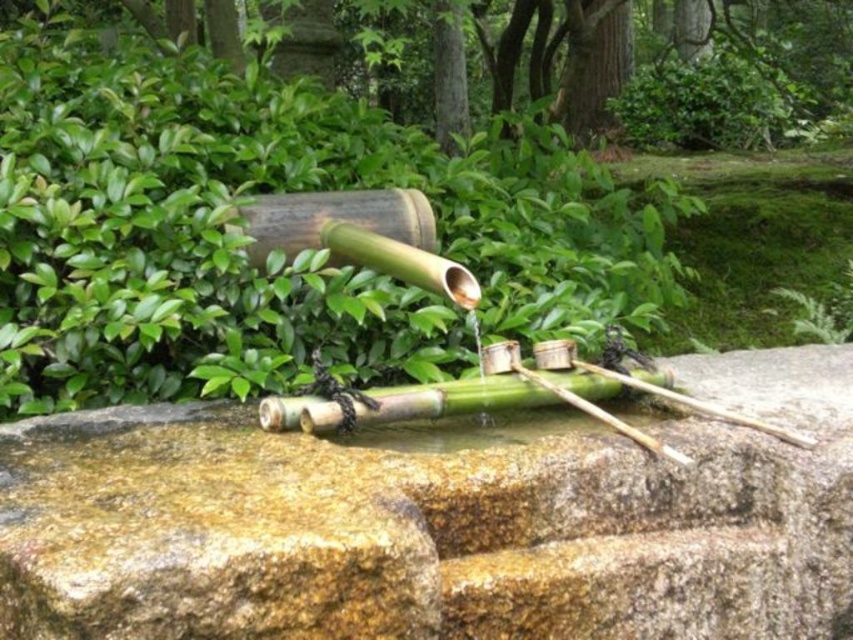
Question: Does green stone basin at center have a greater width compared to green leafy bush at upper left?

Choices:
 (A) yes
 (B) no

Answer: (B)

Question: Which object is farther from the camera taking this photo?

Choices:
 (A) green leafy bush at upper left
 (B) green stone basin at center

Answer: (A)

Question: Which point is farther to the camera?

Choices:
 (A) (659, 189)
 (B) (572, 556)

Answer: (A)

Question: Is green stone basin at center wider than green leafy bush at upper left?

Choices:
 (A) no
 (B) yes

Answer: (A)

Question: Is green stone basin at center below green leafy bush at upper left?

Choices:
 (A) yes
 (B) no

Answer: (A)